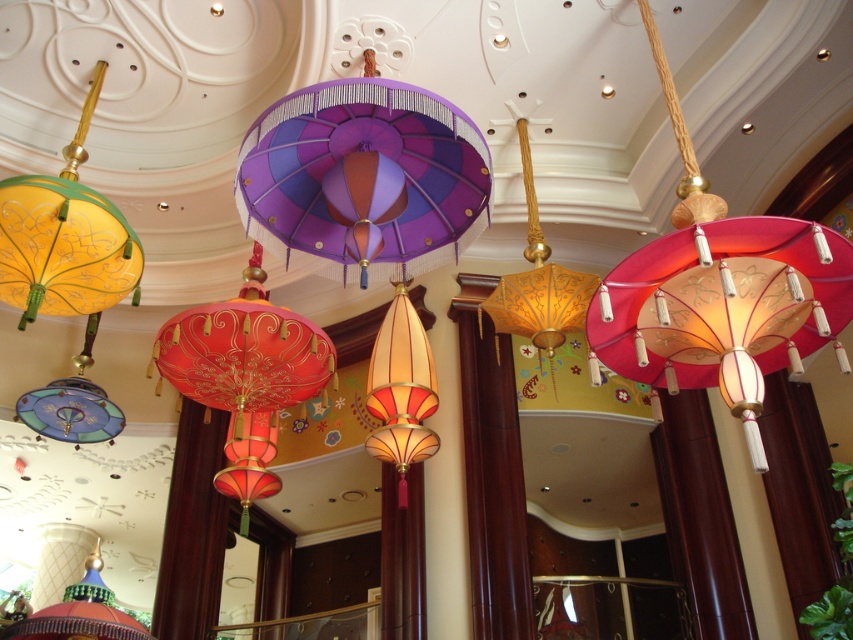
You are standing in the center of the room and want to hang a new decoration directly above the gold paper lantern at center. What coordinates should you aim for to place it precisely above the existing lantern?

The gold paper lantern at center is located at point (538,282), so you should aim for the coordinates directly above it, which would be the same x coordinate 0.442 and a higher y coordinate, such as 0.7 or 0.75, depending on the desired height.

You are an interior designer planning to install a new chandelier in this space. The chandelier requires a minimum of 4 meters of clearance between the two existing lanterns to ensure safety. Based on the scene, can the chandelier be safely installed between the gold paper lantern at center and the blue glass lantern at center?

The gold paper lantern at center and blue glass lantern at center are 4.13 meters apart, which meets the required minimum clearance of 4 meters. Therefore, the chandelier can be safely installed between them.

Based on the photo, you are an interior designer planning to hang a new decorative item between the purple satin lantern at center and the gold paper lantern at center. Based on their sizes, which lantern should you place the new item closer to?

The purple satin lantern at center is wider than the gold paper lantern at center, so you should place the new item closer to the gold paper lantern at center to maintain balance.